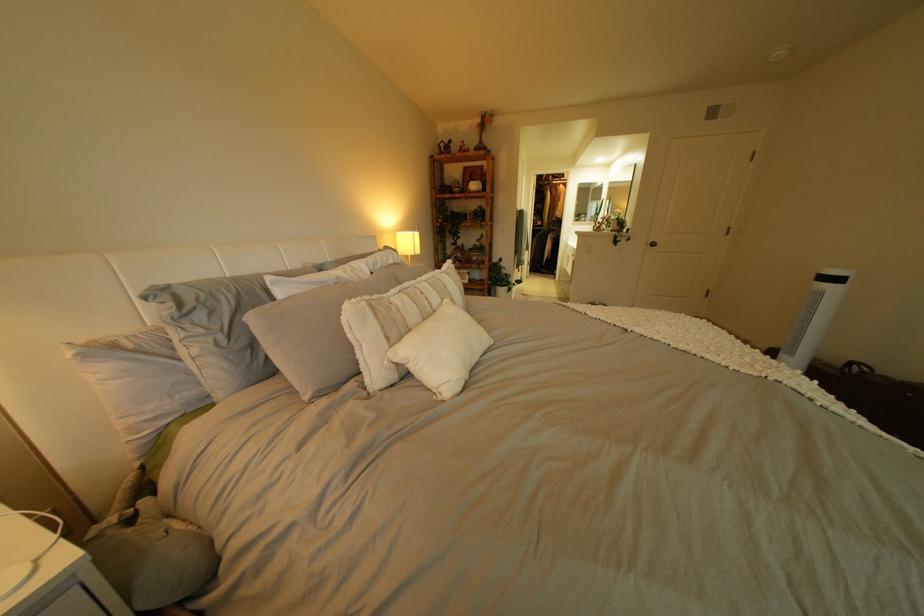
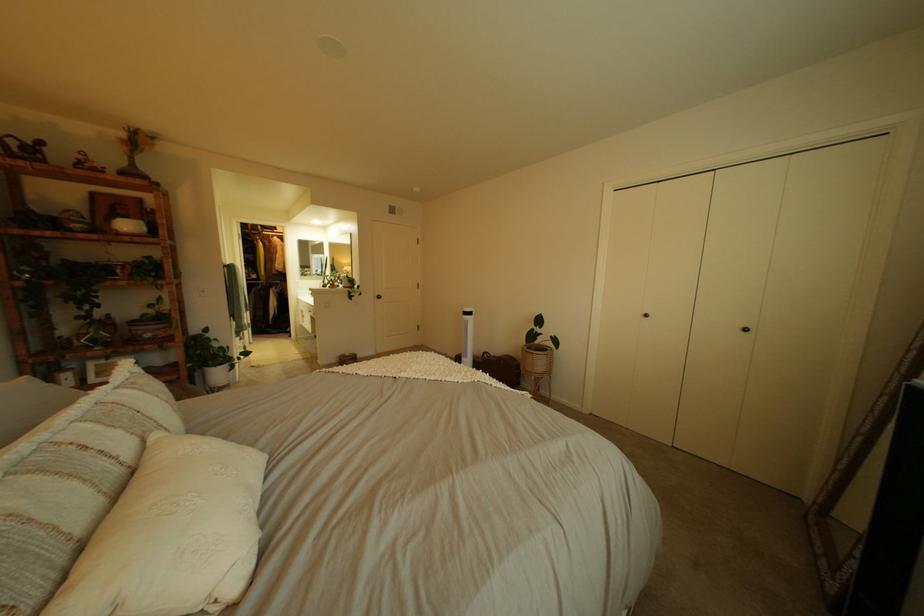
The point at (x=497, y=289) is marked in the first image. Where is the corresponding point in the second image?

(189, 379)